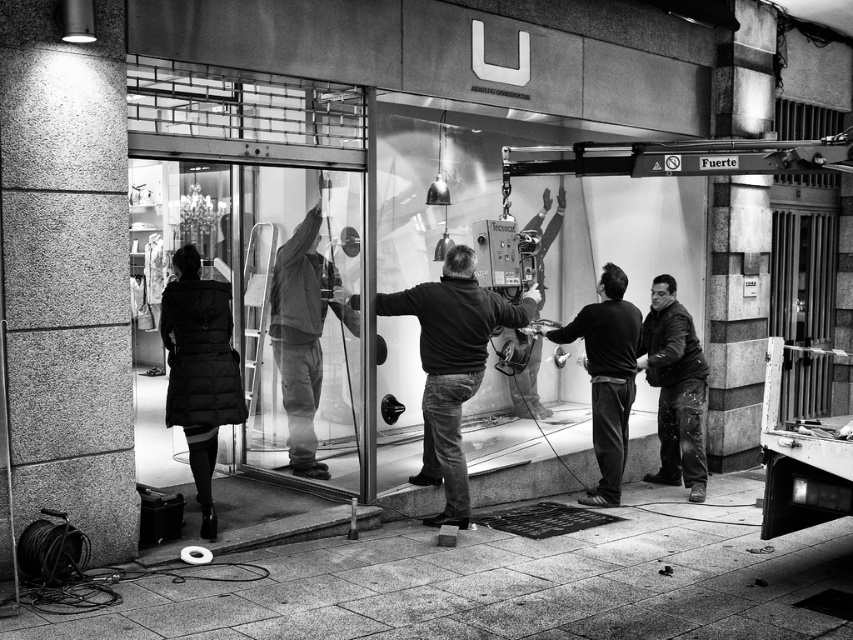
Question: Is the position of transparent glass door at center more distant than that of dark gray jeans at center?

Choices:
 (A) no
 (B) yes

Answer: (A)

Question: Based on their relative distances, which object is nearer to the matte black coat at lower left?

Choices:
 (A) dark gray sweater at center
 (B) dark gray jeans at center

Answer: (A)

Question: Estimate the real-world distances between objects in this image. Which object is farther from the leather jacket at right?

Choices:
 (A) matte black coat at lower left
 (B) dark gray sweater at center
 (C) transparent glass door at center
 (D) dark gray jeans at center

Answer: (A)

Question: Does dark gray sweater at center appear on the right side of matte black coat at lower left?

Choices:
 (A) yes
 (B) no

Answer: (A)

Question: Considering the relative positions of dark gray sweater at center and matte black coat at lower left in the image provided, where is dark gray sweater at center located with respect to matte black coat at lower left?

Choices:
 (A) right
 (B) left

Answer: (A)

Question: Which point is farther to the camera?

Choices:
 (A) (428, 310)
 (B) (259, 298)

Answer: (B)